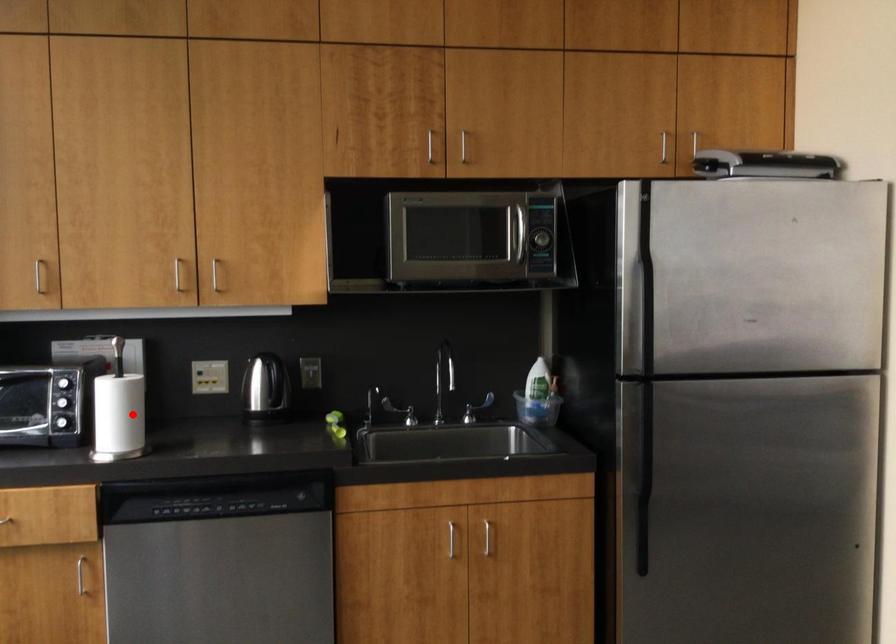
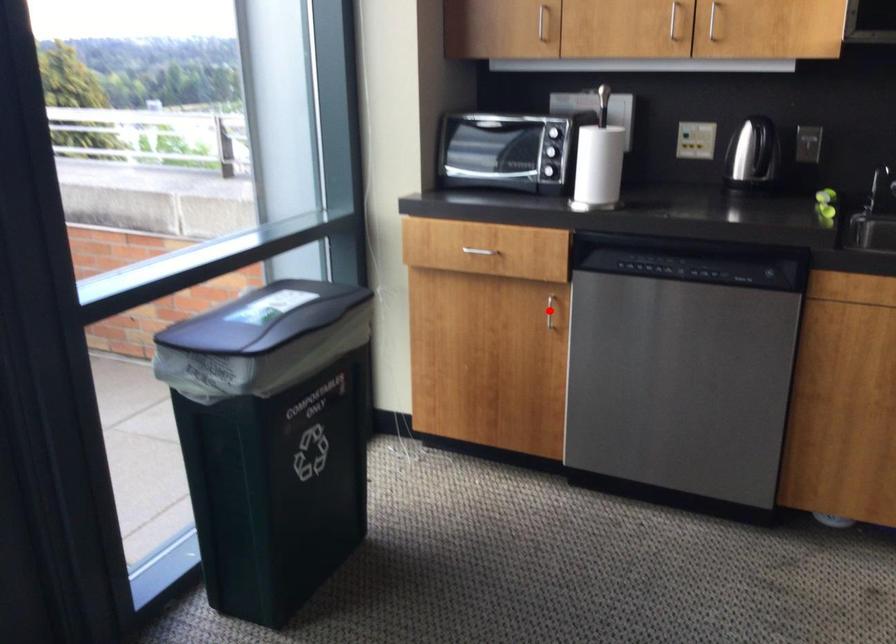
I am providing you with two images of the same scene from different viewpoints. A red point is marked on the first image and another point is marked on the second image. Does the point marked in image1 correspond to the same location as the one in image2?

No